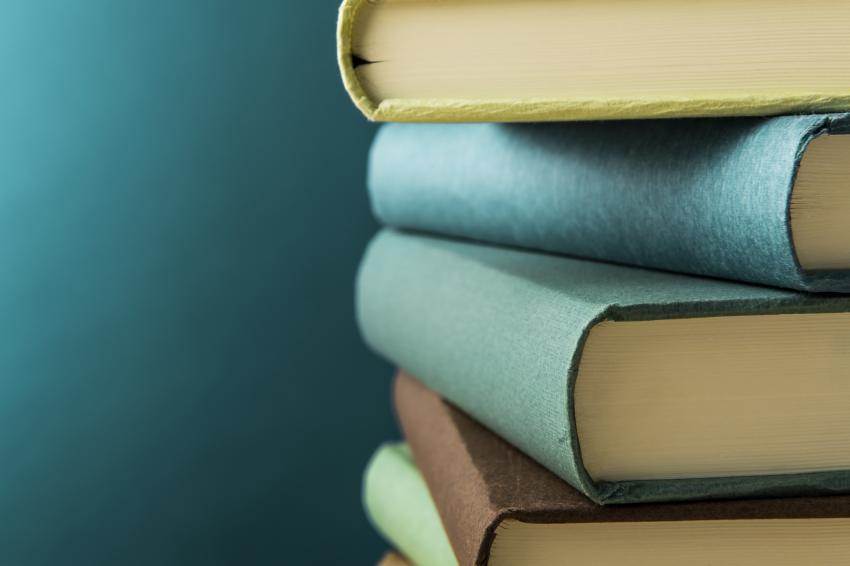
Locate an element on the screen. book is located at coordinates (547, 54), (605, 191), (568, 317), (496, 470), (404, 500), (394, 564).